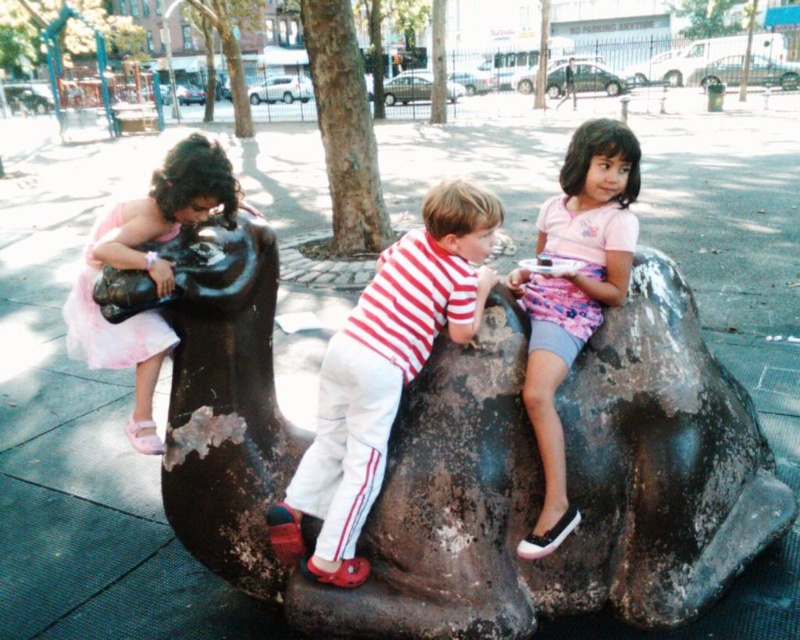
Question: Does pink fabric skirt at upper right have a greater width compared to pink tulle dress at left?

Choices:
 (A) no
 (B) yes

Answer: (A)

Question: Is matte red-striped shirt at center below pink fabric skirt at upper right?

Choices:
 (A) yes
 (B) no

Answer: (A)

Question: Which point is closer to the camera taking this photo?

Choices:
 (A) (336, 376)
 (B) (641, 557)

Answer: (A)

Question: Which point is closer to the camera taking this photo?

Choices:
 (A) (142, 365)
 (B) (506, 404)
 (C) (484, 208)
 (D) (617, 216)

Answer: (C)

Question: Can you confirm if rusty metal sculpture at center is positioned below pink fabric skirt at upper right?

Choices:
 (A) no
 (B) yes

Answer: (B)

Question: Which object is closer to the camera taking this photo?

Choices:
 (A) matte red-striped shirt at center
 (B) rusty metal sculpture at center
 (C) pink fabric skirt at upper right
 (D) pink tulle dress at left

Answer: (D)